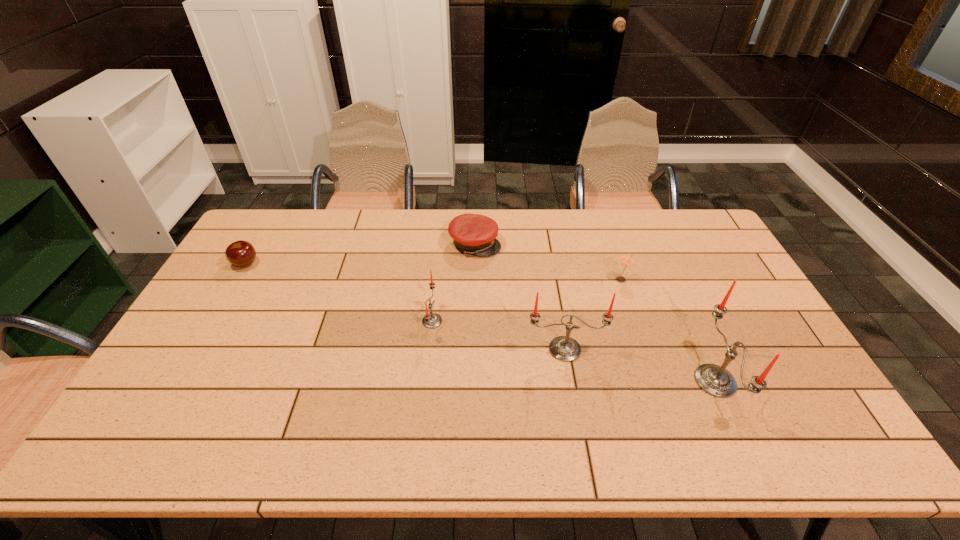
At what (x,y) coordinates should I click in order to perform the action: click on the shortest candle. Please return your answer as a coordinate pair (x, y). This screenshot has height=540, width=960. Looking at the image, I should click on (432, 320).

I want to click on the leftmost candle, so click(432, 320).

Image resolution: width=960 pixels, height=540 pixels. I want to click on the second tallest candle, so click(564, 348).

Identify the location of the fifth shortest object. (564, 348).

Locate an element on the screen. the rightmost object is located at coordinates (715, 380).

Locate an element on the screen. The image size is (960, 540). the leftmost object is located at coordinates (240, 253).

The image size is (960, 540). Identify the location of the fourth object from right to left. (476, 234).

Locate an element on the screen. straw is located at coordinates (626, 259).

This screenshot has height=540, width=960. I want to click on the fourth nearest object, so click(x=626, y=259).

At what (x,y) coordinates should I click in order to perform the action: click on free location located on the front-facing side of the leftmost candle. Please return your answer as a coordinate pair (x, y). This screenshot has height=540, width=960. Looking at the image, I should click on (557, 321).